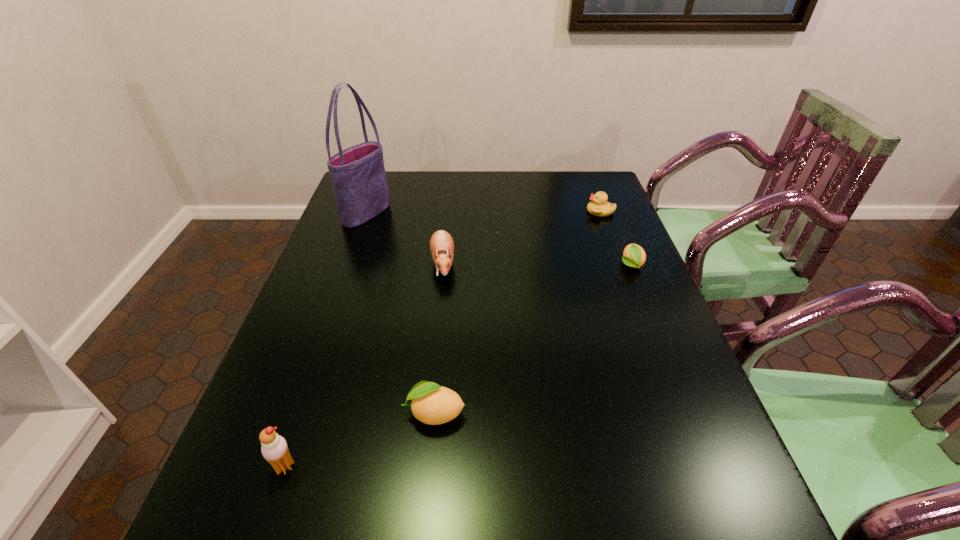
You are a GUI agent. You are given a task and a screenshot of the screen. Output one action in this format:
    pyautogui.click(x=<x>, y=<y>)
    Task: Click on the vacant spot for a new lemon to ensure equal spacing
    
    Given the screenshot: What is the action you would take?
    (549, 327)